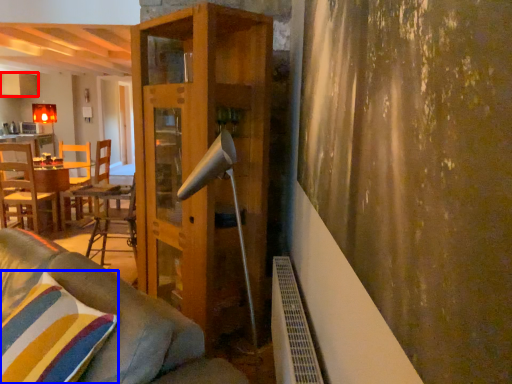
Question: Which object is further to the camera taking this photo, cabinetry (highlighted by a red box) or pillow (highlighted by a blue box)?

Choices:
 (A) cabinetry
 (B) pillow

Answer: (A)